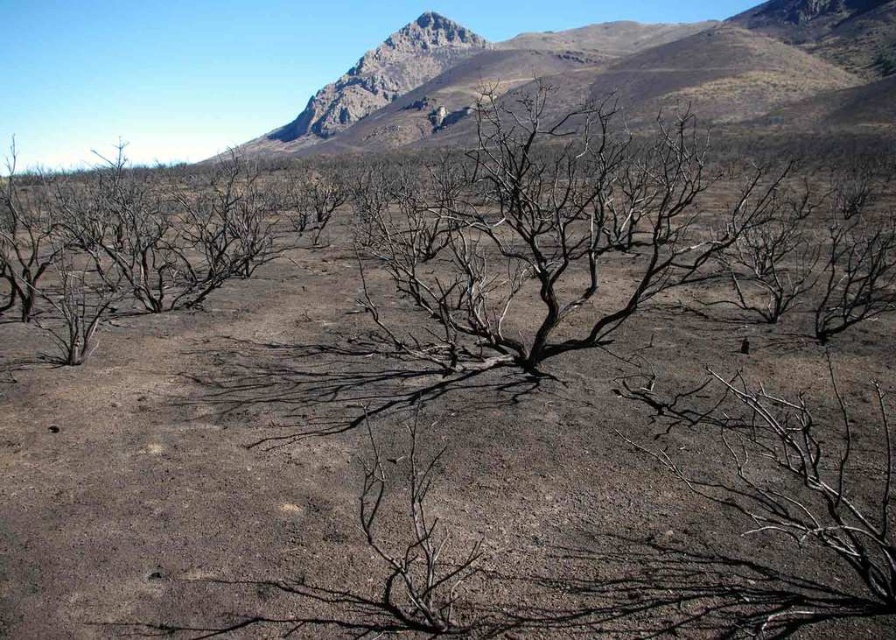
You are standing in the barren landscape with dead trees and dark ground. You see two points marked in the scene. Which point is closer to you, point (207, 602) or point (696, 134)?

Point (207, 602) is closer to you than point (696, 134).

You are a hiker lost in this barren landscape and need to reach the mountains in the background. You see the dark brown dirt field at center and the charred wood tree at center. Which object is closer to you, and which is farther away?

The dark brown dirt field at center is closer to you, while the charred wood tree at center is farther away because the description states that the dark brown dirt field at center is in front of the charred wood tree at center.